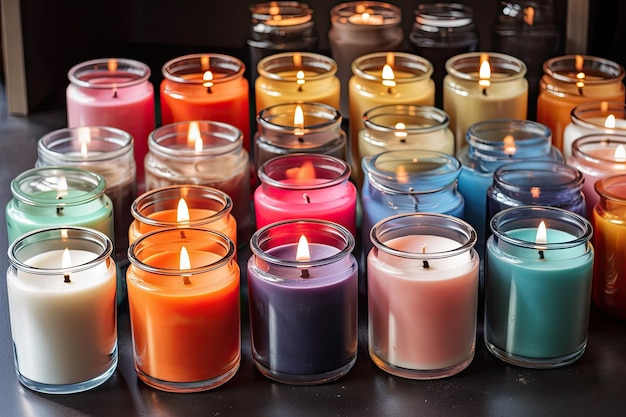
This screenshot has height=417, width=626. I want to click on blue colour group candles, so click(326, 251), click(438, 196), click(508, 180), click(491, 145).